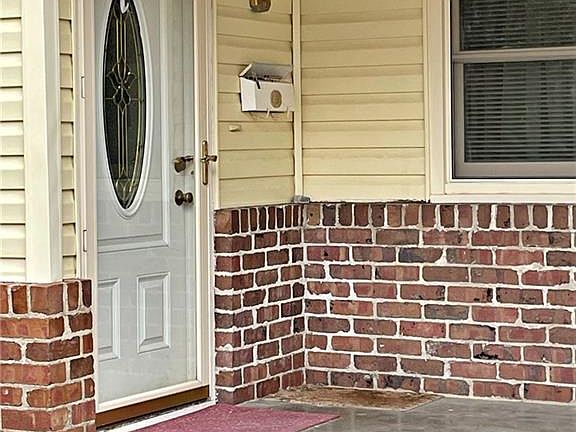
Find the location of a particular element. This screenshot has width=576, height=432. corner is located at coordinates (298, 390).